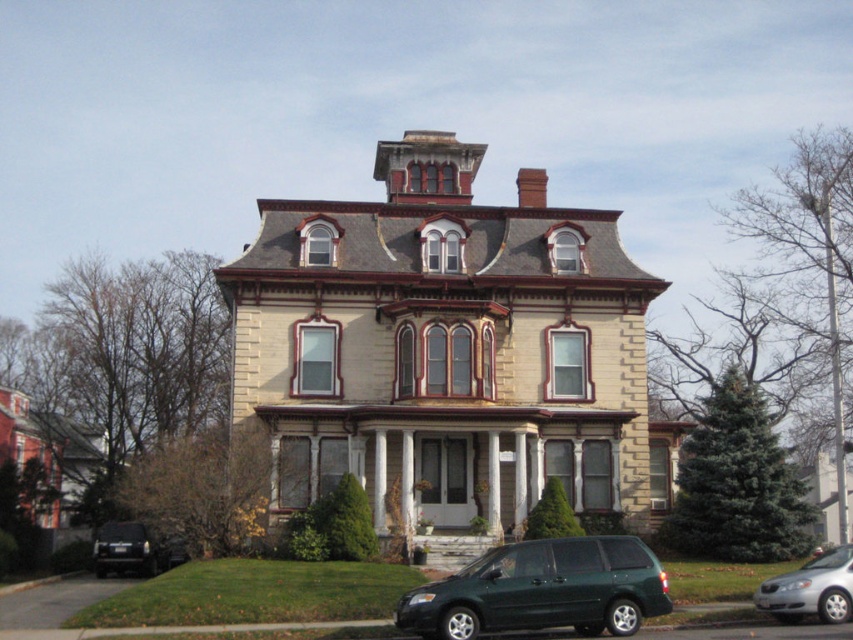
Which is in front, point (509, 627) or point (776, 580)?

Point (509, 627)

In the scene shown: Between green matte van at lower center and silver metallic sedan at lower right, which one appears on the left side from the viewer's perspective?

From the viewer's perspective, green matte van at lower center appears more on the left side.

You are a GUI agent. You are given a task and a screenshot of the screen. Output one action in this format:
    pyautogui.click(x=<x>, y=<y>)
    Task: Click on the green matte van at lower center
    This screenshot has width=853, height=640.
    Given the screenshot: What is the action you would take?
    pyautogui.click(x=543, y=589)

Can you confirm if green matte van at lower center is wider than shiny black suv at lower left?

No.

Who is positioned more to the left, green matte van at lower center or shiny black suv at lower left?

shiny black suv at lower left is more to the left.

Locate an element on the screen. This screenshot has height=640, width=853. green matte van at lower center is located at coordinates (543, 589).

Can you confirm if silver metallic sedan at lower right is wider than shiny black suv at lower left?

No.

Does silver metallic sedan at lower right lie in front of shiny black suv at lower left?

Yes, silver metallic sedan at lower right is closer to the viewer.

Is point (830, 600) farther from viewer compared to point (142, 572)?

No, (830, 600) is in front of (142, 572).

Image resolution: width=853 pixels, height=640 pixels. Identify the location of silver metallic sedan at lower right. (811, 589).